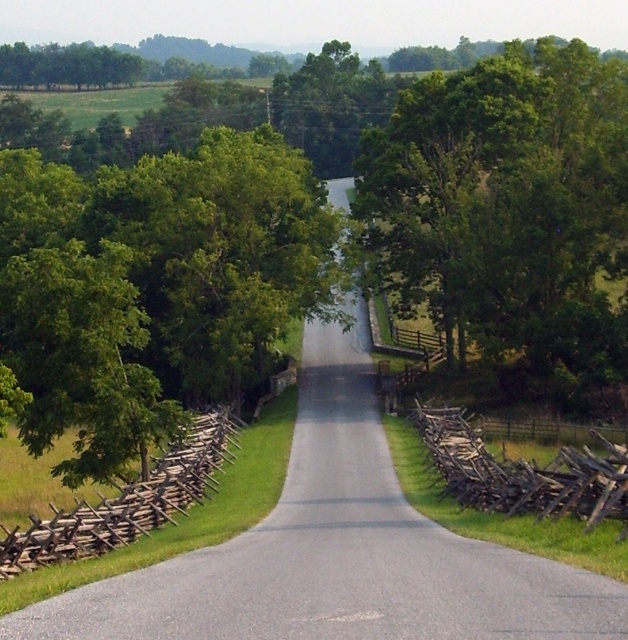
Question: Observing the image, what is the correct spatial positioning of green leafy tree at upper right in reference to weathered wooden fence at right?

Choices:
 (A) left
 (B) right

Answer: (B)

Question: Considering the relative positions of green leafy tree at upper right and brown wooden fence at left in the image provided, where is green leafy tree at upper right located with respect to brown wooden fence at left?

Choices:
 (A) above
 (B) below

Answer: (A)

Question: Does green leafy tree at upper right appear over brown wooden fence at left?

Choices:
 (A) yes
 (B) no

Answer: (A)

Question: Which object appears farthest from the camera in this image?

Choices:
 (A) gray asphalt road at center
 (B) green leafy tree at center
 (C) brown wooden fence at left
 (D) weathered wooden fence at right

Answer: (B)

Question: Which of the following is the closest to the observer?

Choices:
 (A) gray asphalt road at center
 (B) brown wooden fence at left

Answer: (A)

Question: Which point appears farthest from the camera in this image?

Choices:
 (A) (614, 129)
 (B) (421, 544)

Answer: (A)